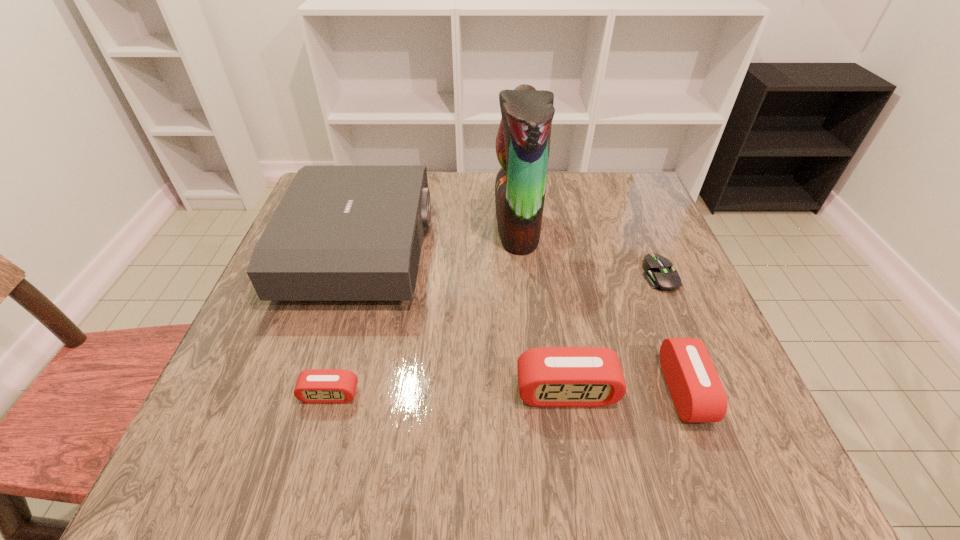
Where is `object that is at the far left corner`? This screenshot has width=960, height=540. object that is at the far left corner is located at coordinates (340, 233).

Identify the location of object located in the near left corner section of the desktop. The image size is (960, 540). (315, 385).

Image resolution: width=960 pixels, height=540 pixels. I want to click on object at the near right corner, so click(x=697, y=392).

In the image, there is a desktop. At what (x,y) coordinates should I click in order to perform the action: click on vacant space at the far edge. Please return your answer as a coordinate pair (x, y). Looking at the image, I should click on (583, 221).

This screenshot has height=540, width=960. In the image, there is a desktop. Identify the location of vacant space at the near edge. (403, 377).

You are a GUI agent. You are given a task and a screenshot of the screen. Output one action in this format:
    pyautogui.click(x=<x>, y=<y>)
    Task: Click on the free space at the left edge
    
    Given the screenshot: What is the action you would take?
    pyautogui.click(x=336, y=304)

In the image, there is a desktop. Where is `vacant space at the right edge`? The image size is (960, 540). vacant space at the right edge is located at coordinates (686, 300).

Identify the location of blank space at the far right corner. Image resolution: width=960 pixels, height=540 pixels. (612, 214).

You are a GUI agent. You are given a task and a screenshot of the screen. Output one action in this format:
    pyautogui.click(x=<x>, y=<y>)
    Task: Click on the vacant area that lies between the second tallest object and the parrot
    
    Given the screenshot: What is the action you would take?
    pyautogui.click(x=439, y=238)

In order to click on unoccupied area between the computer mouse and the second shortest alarm clock in this screenshot , I will do `click(672, 333)`.